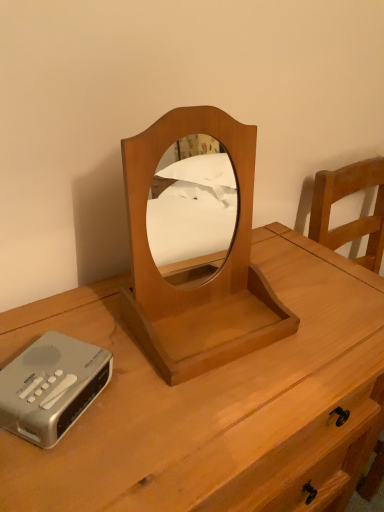
Question: Is silver metallic cassette at lower left not near wooden mirror at center?

Choices:
 (A) no
 (B) yes

Answer: (A)

Question: From the image's perspective, is silver metallic cassette at lower left located beneath wooden mirror at center?

Choices:
 (A) yes
 (B) no

Answer: (A)

Question: Can you confirm if silver metallic cassette at lower left is smaller than wooden mirror at center?

Choices:
 (A) no
 (B) yes

Answer: (B)

Question: From a real-world perspective, is silver metallic cassette at lower left positioned under wooden mirror at center based on gravity?

Choices:
 (A) no
 (B) yes

Answer: (B)

Question: Is the position of silver metallic cassette at lower left more distant than that of wooden mirror at center?

Choices:
 (A) yes
 (B) no

Answer: (A)

Question: Considering the positions of silver metallic cassette at lower left and light brown wood nightstand at center in the image, is silver metallic cassette at lower left taller or shorter than light brown wood nightstand at center?

Choices:
 (A) tall
 (B) short

Answer: (B)

Question: Looking at the image, does silver metallic cassette at lower left seem bigger or smaller compared to light brown wood nightstand at center?

Choices:
 (A) small
 (B) big

Answer: (A)

Question: Considering the positions of point pyautogui.click(x=4, y=428) and point pyautogui.click(x=66, y=456), is point pyautogui.click(x=4, y=428) closer or farther from the camera than point pyautogui.click(x=66, y=456)?

Choices:
 (A) farther
 (B) closer

Answer: (A)

Question: In terms of width, does silver metallic cassette at lower left look wider or thinner when compared to light brown wood nightstand at center?

Choices:
 (A) thin
 (B) wide

Answer: (A)

Question: Is light brown wood nightstand at center bigger or smaller than wooden mirror at center?

Choices:
 (A) small
 (B) big

Answer: (B)

Question: Is point (39, 303) closer or farther from the camera than point (145, 287)?

Choices:
 (A) farther
 (B) closer

Answer: (A)

Question: In terms of height, does light brown wood nightstand at center look taller or shorter compared to wooden mirror at center?

Choices:
 (A) tall
 (B) short

Answer: (A)

Question: Considering the positions of light brown wood nightstand at center and wooden mirror at center in the image, is light brown wood nightstand at center wider or thinner than wooden mirror at center?

Choices:
 (A) thin
 (B) wide

Answer: (B)

Question: Is wooden mirror at center bigger or smaller than light brown wood nightstand at center?

Choices:
 (A) big
 (B) small

Answer: (B)

Question: From their relative heights in the image, would you say wooden mirror at center is taller or shorter than light brown wood nightstand at center?

Choices:
 (A) tall
 (B) short

Answer: (B)